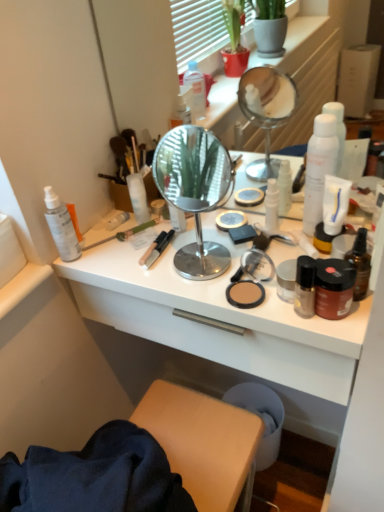
Where is `vacant region to the left of satin black nail polish at right, which appears as the sixth toiletry when viewed from the left`? The height and width of the screenshot is (512, 384). vacant region to the left of satin black nail polish at right, which appears as the sixth toiletry when viewed from the left is located at coordinates (217, 296).